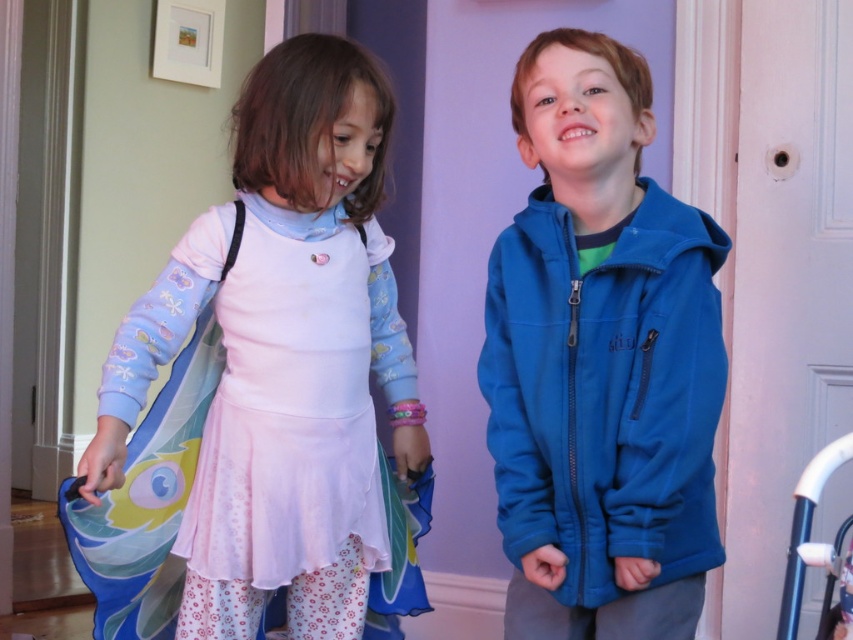
Does pastel pink fabric dress at center have a larger size compared to blue fleece jacket at center?

Yes, pastel pink fabric dress at center is bigger than blue fleece jacket at center.

Who is more distant from viewer, [193,284] or [613,48]?

Positioned behind is point [193,284].

This screenshot has height=640, width=853. Identify the location of pastel pink fabric dress at center. (279, 362).

Image resolution: width=853 pixels, height=640 pixels. I want to click on pastel pink fabric dress at center, so click(279, 362).